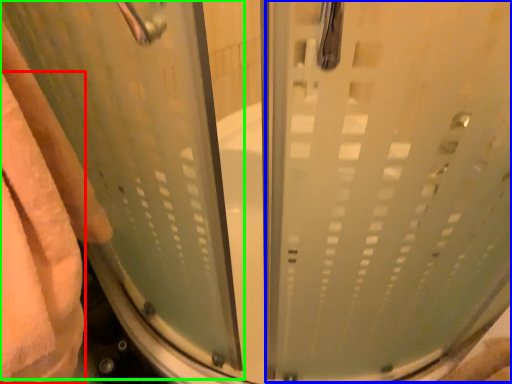
Question: Which object is positioned farthest from bath towel (highlighted by a red box)? Select from screen door (highlighted by a blue box) and screen door (highlighted by a green box).

Choices:
 (A) screen door
 (B) screen door

Answer: (A)